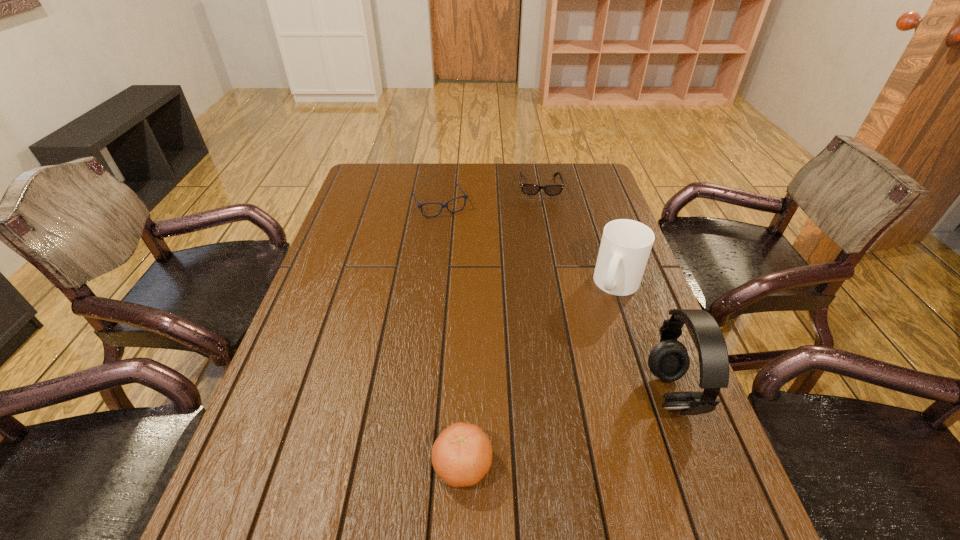
Image resolution: width=960 pixels, height=540 pixels. What are the coordinates of `object that is at the far right corner` in the screenshot? It's located at (528, 189).

Find the location of `vacant space at the far edge`. vacant space at the far edge is located at coordinates (509, 184).

Identify the location of vacant region at the near edge of the desktop. This screenshot has width=960, height=540. 518,471.

Find the location of a particular element. vacant space at the left edge of the desktop is located at coordinates (337, 244).

I want to click on vacant space at the right edge of the desktop, so click(x=593, y=237).

You are a GUI agent. You are given a task and a screenshot of the screen. Output one action in this format:
    pyautogui.click(x=<x>, y=<y>)
    Task: Click on the blank region between the left spectacles and the second tallest object
    Image resolution: width=960 pixels, height=540 pixels.
    Given the screenshot: What is the action you would take?
    pyautogui.click(x=529, y=245)

Identify the location of vacant region between the third farthest object and the right spectacles. This screenshot has width=960, height=540. (579, 235).

Identify the location of blank region between the second tallest object and the right spectacles. (579, 235).

You are a GUI agent. You are given a task and a screenshot of the screen. Output one action in this format:
    pyautogui.click(x=<x>, y=<y>)
    Task: Click on the empty location between the mug and the third shortest object
    The height and width of the screenshot is (540, 960).
    Given the screenshot: What is the action you would take?
    pyautogui.click(x=540, y=375)

What are the coordinates of `empty space that is in between the left spectacles and the clementine` in the screenshot? It's located at (451, 335).